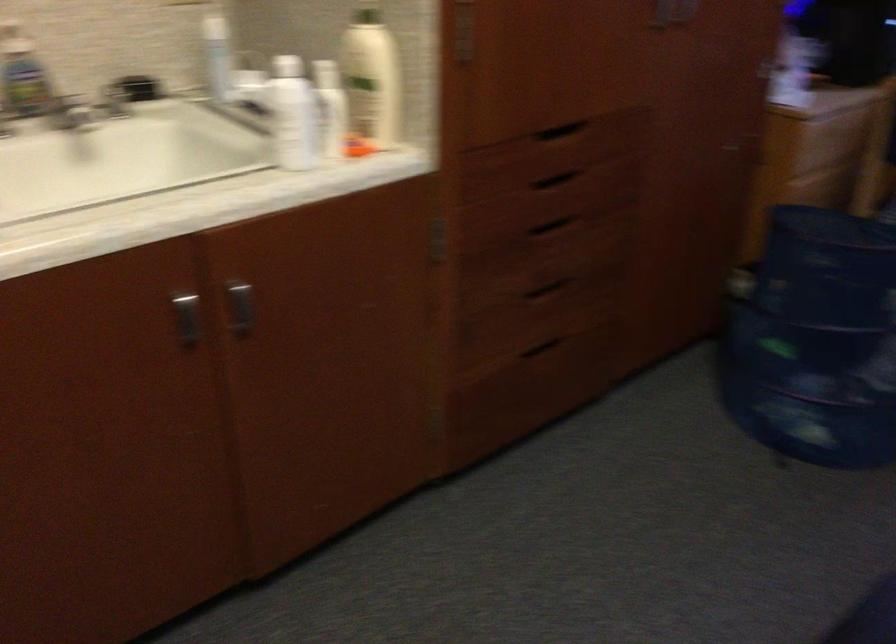
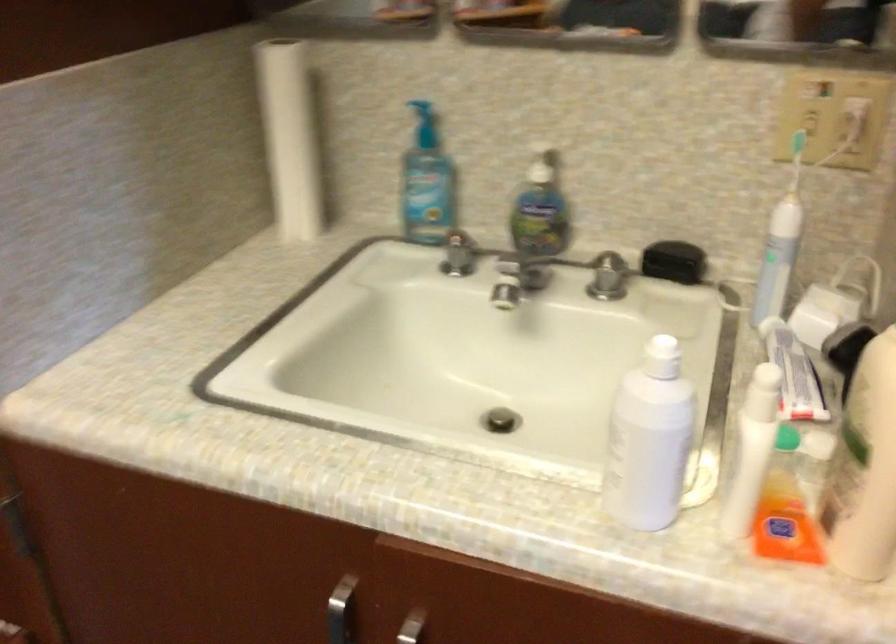
Question: Based on the continuous images, in which direction is the camera rotating? Reply with the corresponding letter.

Choices:
 (A) Left
 (B) Right
 (C) Up
 (D) Down

Answer: (A)